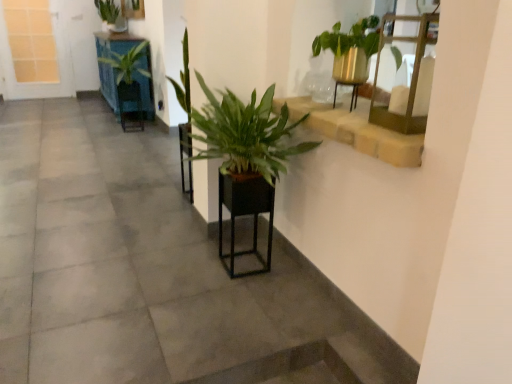
Locate an element on the screen. Image resolution: width=512 pixels, height=384 pixels. free location in front of green matte plant at center, the 2th armchair when ordered from top to bottom is located at coordinates (176, 208).